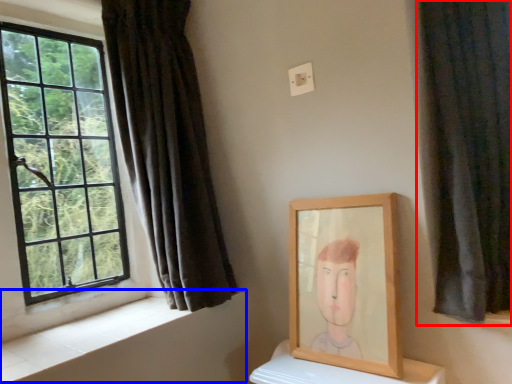
Question: Which object is closer to the camera taking this photo, curtain (highlighted by a red box) or window sill (highlighted by a blue box)?

Choices:
 (A) curtain
 (B) window sill

Answer: (A)